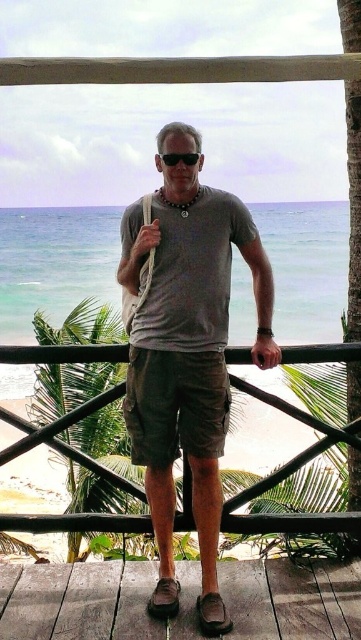
Question: Estimate the real-world distances between objects in this image. Which object is farther from the dark green cotton shorts at center?

Choices:
 (A) brown wooden deck at lower center
 (B) black plastic goggles at center

Answer: (B)

Question: Can you confirm if brown wooden deck at lower center is positioned below dark green cotton shorts at center?

Choices:
 (A) yes
 (B) no

Answer: (A)

Question: Considering the real-world distances, which object is closest to the brown wooden deck at lower center?

Choices:
 (A) dark green cotton shorts at center
 (B) black plastic goggles at center

Answer: (A)

Question: Does matte gray t-shirt at center have a smaller size compared to dark green cotton shorts at center?

Choices:
 (A) no
 (B) yes

Answer: (A)

Question: Is brown wooden deck at lower center smaller than black plastic goggles at center?

Choices:
 (A) no
 (B) yes

Answer: (A)

Question: Among these points, which one is farthest from the camera?

Choices:
 (A) (141, 586)
 (B) (193, 390)
 (C) (184, 156)
 (D) (145, 426)

Answer: (A)